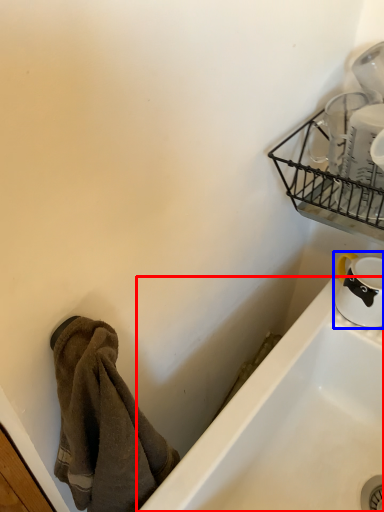
Question: Which object appears farthest to the camera in this image, bathtub (highlighted by a red box) or tableware (highlighted by a blue box)?

Choices:
 (A) bathtub
 (B) tableware

Answer: (B)